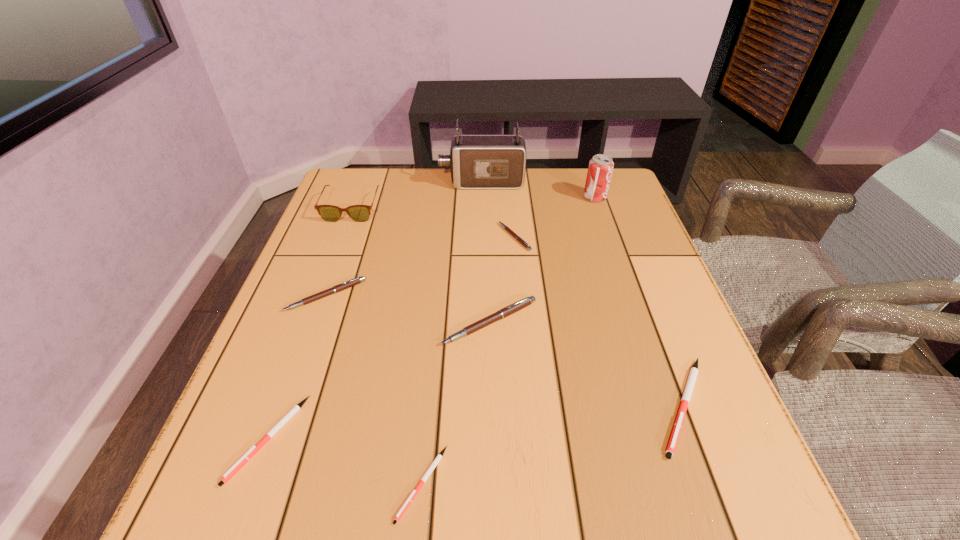
Image resolution: width=960 pixels, height=540 pixels. Find the location of `the biggest white pen`. the biggest white pen is located at coordinates (687, 393).

Where is `the farthest pink pen`? This screenshot has width=960, height=540. the farthest pink pen is located at coordinates (518, 238).

Where is `the fourth farthest object`? The height and width of the screenshot is (540, 960). the fourth farthest object is located at coordinates (518, 238).

The height and width of the screenshot is (540, 960). In order to click on the leftmost white pen in this screenshot , I will do `click(296, 408)`.

Where is `the shortest object`? the shortest object is located at coordinates (439, 456).

Where is `the shortest pen`? The width and height of the screenshot is (960, 540). the shortest pen is located at coordinates (439, 456).

Locate an element on the screen. The image size is (960, 540). free point located at the lens of the camcorder is located at coordinates (x=346, y=183).

Find the location of a particular element. The height and width of the screenshot is (540, 960). vacant area situated 0.100m at the lens of the camcorder is located at coordinates (407, 183).

The image size is (960, 540). In order to click on free space located 0.170m at the lens of the camcorder in this screenshot , I will do pos(383,183).

Where is `free point located 0.060m on the left of the soda can`? free point located 0.060m on the left of the soda can is located at coordinates (562, 198).